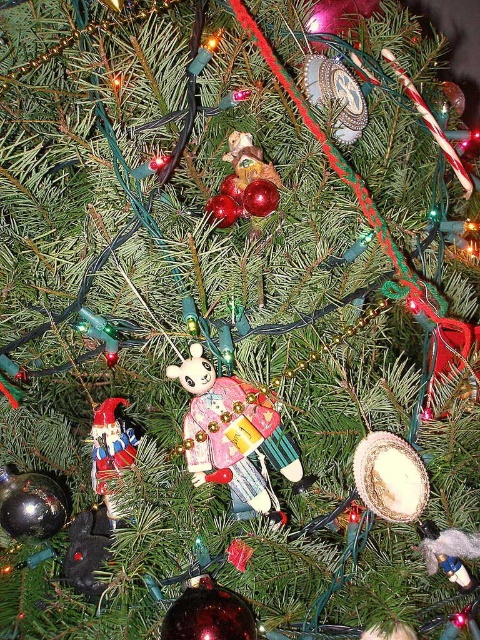
Question: Among these objects, which one is nearest to the camera?

Choices:
 (A) wooden nutcracker at center
 (B) shiny metallic nutcracker at lower left

Answer: (A)

Question: Which object is farther from the camera taking this photo?

Choices:
 (A) wooden nutcracker at center
 (B) shiny metallic nutcracker at lower left

Answer: (B)

Question: From the image, what is the correct spatial relationship of wooden nutcracker at center in relation to shiny metallic nutcracker at lower left?

Choices:
 (A) right
 (B) left

Answer: (A)

Question: Can you confirm if wooden nutcracker at center is bigger than shiny metallic nutcracker at lower left?

Choices:
 (A) no
 (B) yes

Answer: (B)

Question: Can you confirm if wooden nutcracker at center is positioned to the left of shiny metallic nutcracker at lower left?

Choices:
 (A) no
 (B) yes

Answer: (A)